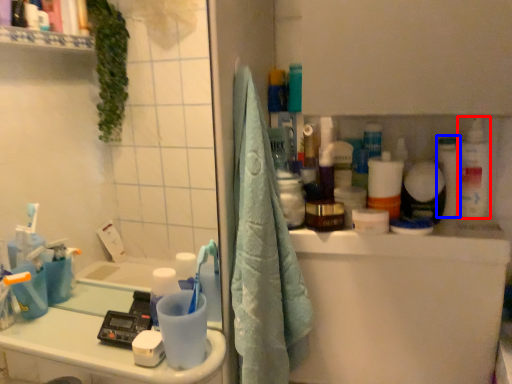
Question: Which object appears farthest to the camera in this image, cleaning product (highlighted by a red box) or toiletry (highlighted by a blue box)?

Choices:
 (A) cleaning product
 (B) toiletry

Answer: (B)